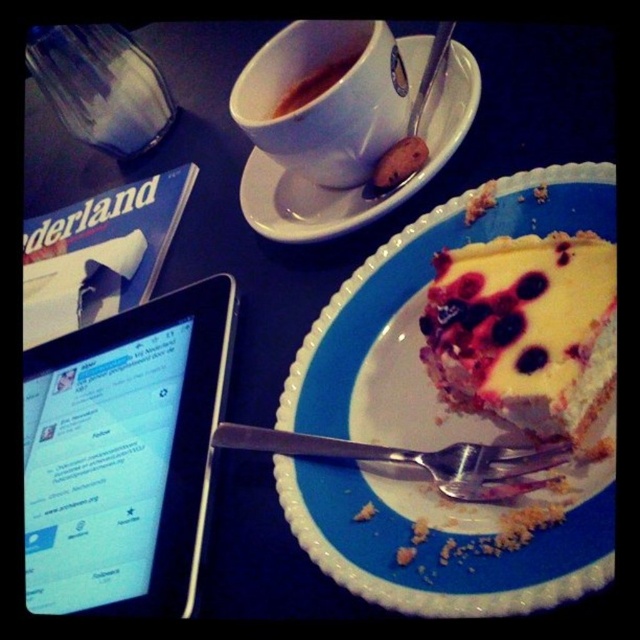
Question: Where is white ceramic cup at upper center located in relation to silver metallic fork at lower center in the image?

Choices:
 (A) left
 (B) right

Answer: (A)

Question: Which is farther from the silver metallic spoon at upper center?

Choices:
 (A) yellow cake at right
 (B) glossy ceramic mug at upper center
 (C) yellow creamy cake at right

Answer: (C)

Question: Does white ceramic saucer at upper center appear under silver metallic fork at lower center?

Choices:
 (A) no
 (B) yes

Answer: (A)

Question: Does yellow cake at right lie in front of silver metallic fork at lower center?

Choices:
 (A) no
 (B) yes

Answer: (B)

Question: Which point is farther from the camera taking this photo?

Choices:
 (A) coord(442,49)
 (B) coord(499,380)

Answer: (A)

Question: Which is nearer to the silver metallic spoon at upper center?

Choices:
 (A) yellow cake at right
 (B) white ceramic saucer at upper center
 (C) silver metallic fork at lower center
 (D) white ceramic cup at upper center

Answer: (B)